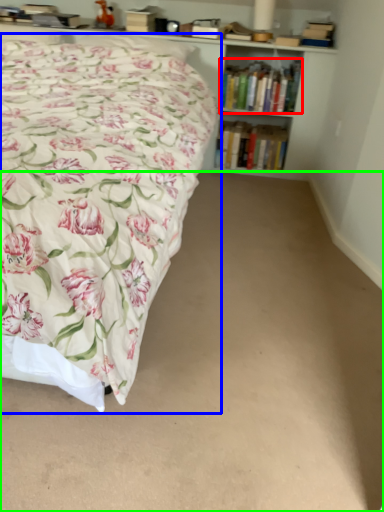
Question: Which is farther away from book (highlighted by a red box)? bed (highlighted by a blue box) or plain (highlighted by a green box)?

Choices:
 (A) bed
 (B) plain

Answer: (B)